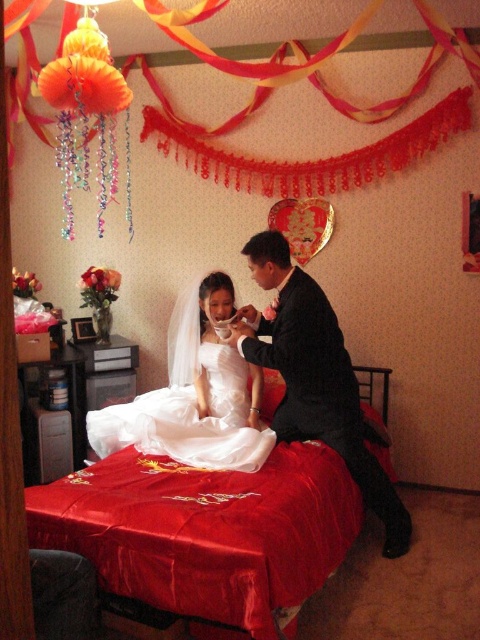
You are a photographer positioned at the entrance of the room. You need to capture a photo of the silky satin bed at center. Given that the room has a ceiling height of 3 meters and you are standing 2 meters away from the bed, will you be able to frame the entire bed in your shot without moving closer or further away?

The silky satin bed at center is located at point (205,531), which means it is positioned towards the right side of the room. Since you are standing 2 meters away from it and the ceiling height is 3 meters, you should be able to frame the entire bed in your shot without needing to adjust your distance. Adjust your camera angle slightly to the right to ensure the bed is fully captured.